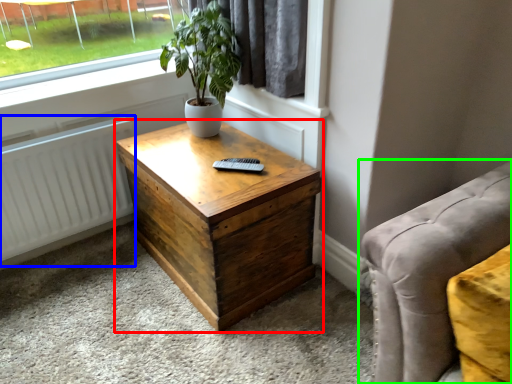
Question: Which is farther away from nightstand (highlighted by a red box)? radiator (highlighted by a blue box) or studio couch (highlighted by a green box)?

Choices:
 (A) radiator
 (B) studio couch

Answer: (B)